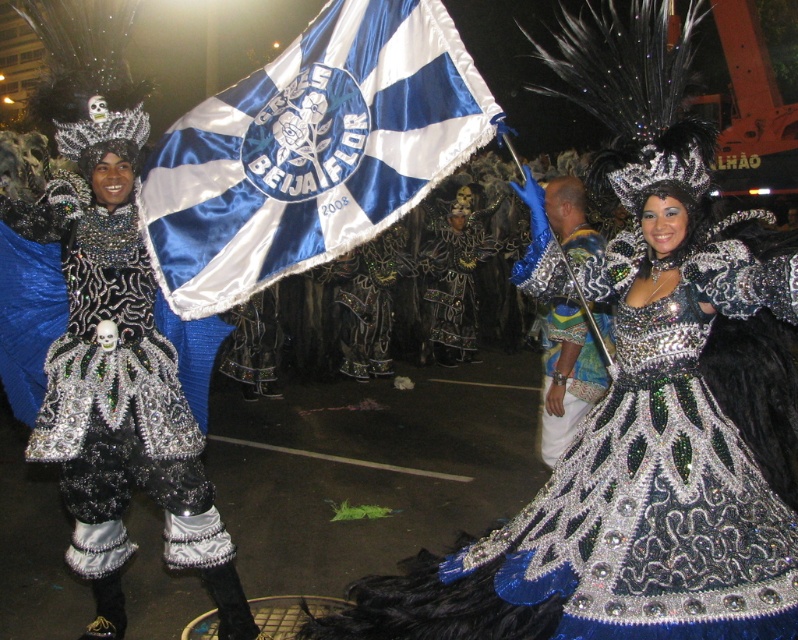
You are a photographer at the carnival and want to capture both the blue satin flag at center and the shiny silver dress at center in a single frame. Given that your camera has a fixed focal length and limited horizontal field of view, which object should you position closer to the center of the frame to ensure both are fully visible?

The blue satin flag at center is wider than the shiny silver dress at center. To ensure both are fully visible in the frame, you should position the wider blue satin flag at center closer to the center of the frame. This placement allows the narrower shiny silver dress at center to fit within the limited horizontal field of view while keeping the flag centered.